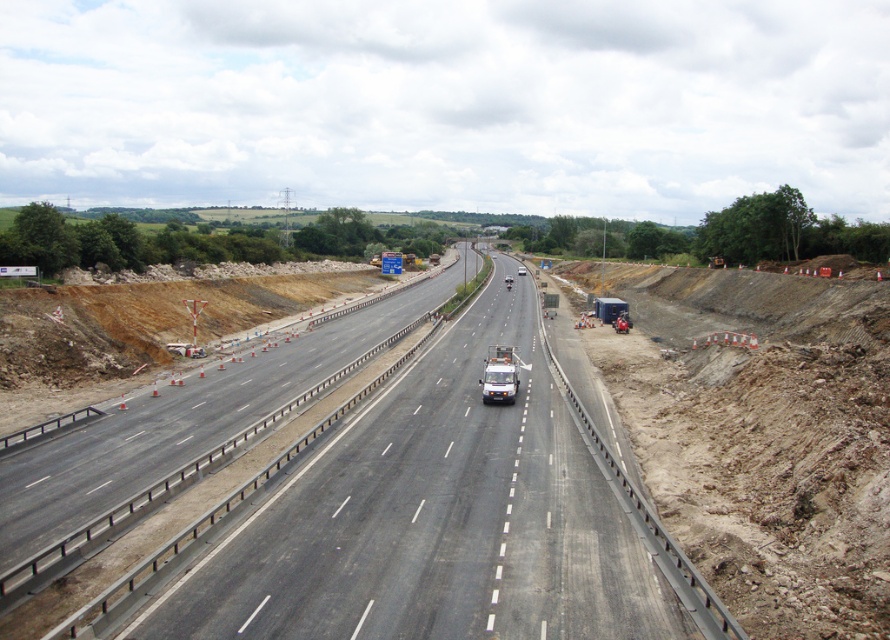
You are a surveyor standing at the edge of the highway. You need to determine which of the two points, point (x=640, y=611) or point (x=619, y=314), is closer to your current position. Based on the scene description, which point is nearer to you?

Point (x=640, y=611) is closer to the viewer than point (x=619, y=314), so the surveyor should note that point (x=640, y=611) is nearer to their current position.

You are a construction worker standing at the point with coordinates 0.811, 0.508. You need to reach the asphalt road at center as quickly as possible. Which direction should you move in?

The asphalt road at center is located at point (451, 518), so you are already at the asphalt road at center.